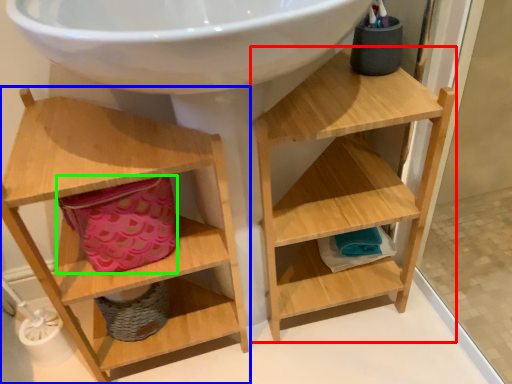
Question: Which object is the farthest from shelf (highlighted by a red box)? Choose among these: shelf (highlighted by a blue box) or basket (highlighted by a green box).

Choices:
 (A) shelf
 (B) basket

Answer: (B)